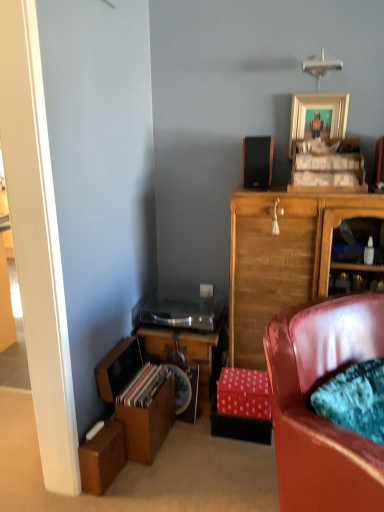
You are a GUI agent. You are given a task and a screenshot of the screen. Output one action in this format:
    pyautogui.click(x=<x>, y=<y>)
    Task: Click on the free point in front of brown cardboard box at lower left, acting as the second cardboard box starting from the right
    The height and width of the screenshot is (512, 384).
    Given the screenshot: What is the action you would take?
    pyautogui.click(x=100, y=501)